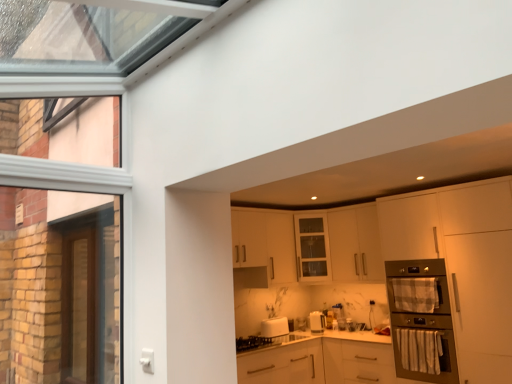
Question: Is metallic stainless steel oven at right closer to camera compared to plaid fabric oven door at right?

Choices:
 (A) no
 (B) yes

Answer: (B)

Question: Is metallic stainless steel oven at right to the right of plaid fabric oven door at right from the viewer's perspective?

Choices:
 (A) no
 (B) yes

Answer: (B)

Question: Can you confirm if metallic stainless steel oven at right is shorter than plaid fabric oven door at right?

Choices:
 (A) yes
 (B) no

Answer: (B)

Question: From the image's perspective, does metallic stainless steel oven at right appear higher than plaid fabric oven door at right?

Choices:
 (A) yes
 (B) no

Answer: (B)

Question: Is metallic stainless steel oven at right turned away from plaid fabric oven door at right?

Choices:
 (A) no
 (B) yes

Answer: (B)

Question: From the image's perspective, relative to metallic stainless steel oven at right, is white glossy toaster at lower center above or below?

Choices:
 (A) above
 (B) below

Answer: (B)

Question: Choose the correct answer: Is white glossy toaster at lower center inside metallic stainless steel oven at right or outside it?

Choices:
 (A) outside
 (B) inside

Answer: (A)

Question: Considering their positions, is white glossy toaster at lower center located in front of or behind metallic stainless steel oven at right?

Choices:
 (A) behind
 (B) front

Answer: (A)

Question: Is white glossy toaster at lower center wider or thinner than metallic stainless steel oven at right?

Choices:
 (A) wide
 (B) thin

Answer: (B)

Question: Would you say plaid fabric oven door at right is inside or outside white glossy toaster at lower center?

Choices:
 (A) inside
 (B) outside

Answer: (B)

Question: Is point click(x=407, y=294) positioned closer to the camera than point click(x=286, y=329)?

Choices:
 (A) farther
 (B) closer

Answer: (B)

Question: Visually, is plaid fabric oven door at right positioned to the left or to the right of white glossy toaster at lower center?

Choices:
 (A) right
 (B) left

Answer: (A)

Question: Relative to white glossy toaster at lower center, is plaid fabric oven door at right in front or behind?

Choices:
 (A) front
 (B) behind

Answer: (A)

Question: In terms of height, does white matte cabinet at upper center, arranged as the 3th cabinetry when ordered from the bottom, look taller or shorter compared to brown wooden screen door at left?

Choices:
 (A) tall
 (B) short

Answer: (B)

Question: From a real-world perspective, is white matte cabinet at upper center, which is counted as the 1th cabinetry, starting from the top, above or below brown wooden screen door at left?

Choices:
 (A) below
 (B) above

Answer: (B)